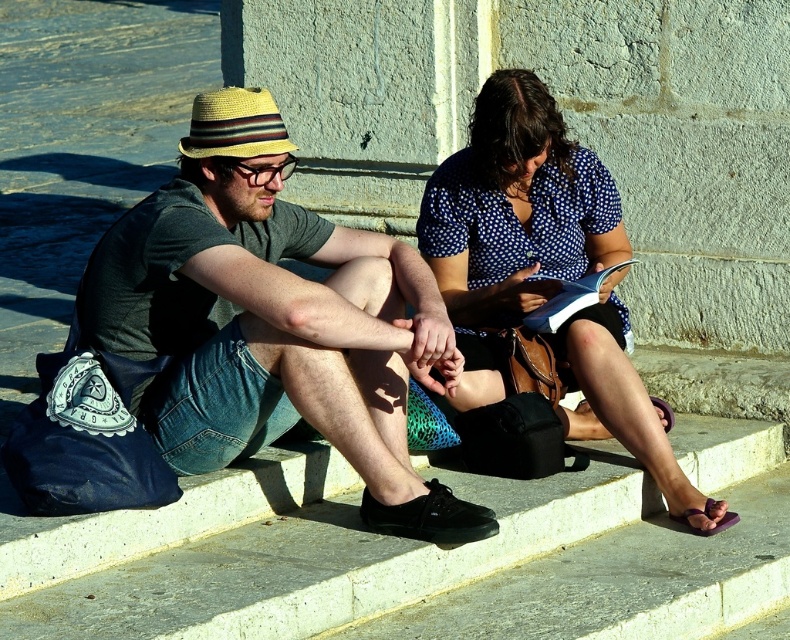
You are a photographer trying to capture a closeup of the purple fabric sandal at lower right without including the black canvas shoe at lower center in the frame. Is this possible given their positions?

The black canvas shoe at lower center is located above the purple fabric sandal at lower right. Since the black canvas shoe is above, it would block the view of the purple fabric sandal at lower right unless moved. Therefore, capturing the purple fabric sandal at lower right without the black canvas shoe at lower center would not be possible without adjusting their positions.

You are a photographer trying to capture both the black canvas shoe at lower center and the purple fabric sandal at lower right in a single shot. Which one of these shoes will appear larger in the photo?

The black canvas shoe at lower center will appear larger in the photo because it is closer to the viewer than the purple fabric sandal at lower right.

Based on the photo, you are standing in the public space shown in the image. There is a point marked at coordinates (431, 516). What object is located at that point?

The black canvas shoe at lower center is located at point (431, 516).